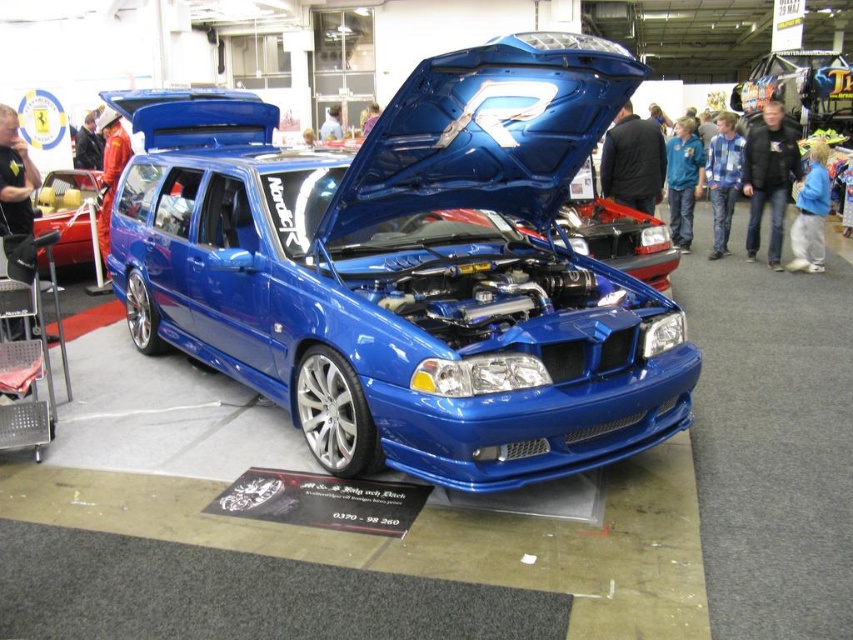
Question: Does shiny blue car at center have a lesser width compared to metallic yellow car at left?

Choices:
 (A) no
 (B) yes

Answer: (A)

Question: Which point is closer to the camera?

Choices:
 (A) shiny blue car at center
 (B) metallic yellow car at left

Answer: (A)

Question: Does shiny blue car at center appear under metallic yellow car at left?

Choices:
 (A) no
 (B) yes

Answer: (B)

Question: Which point appears farthest from the camera in this image?

Choices:
 (A) (436, 60)
 (B) (86, 236)

Answer: (B)

Question: In this image, where is shiny blue car at center located relative to metallic yellow car at left?

Choices:
 (A) left
 (B) right

Answer: (B)